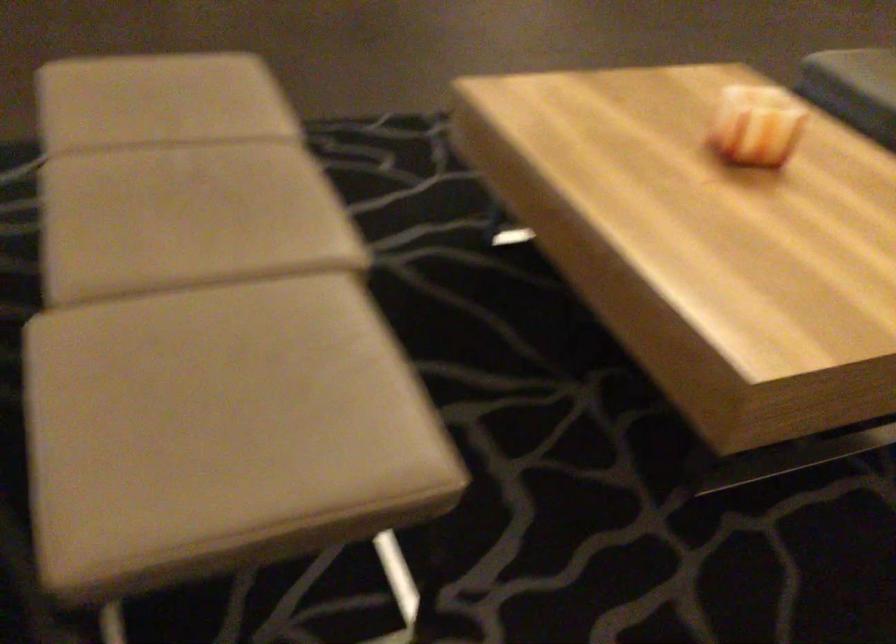
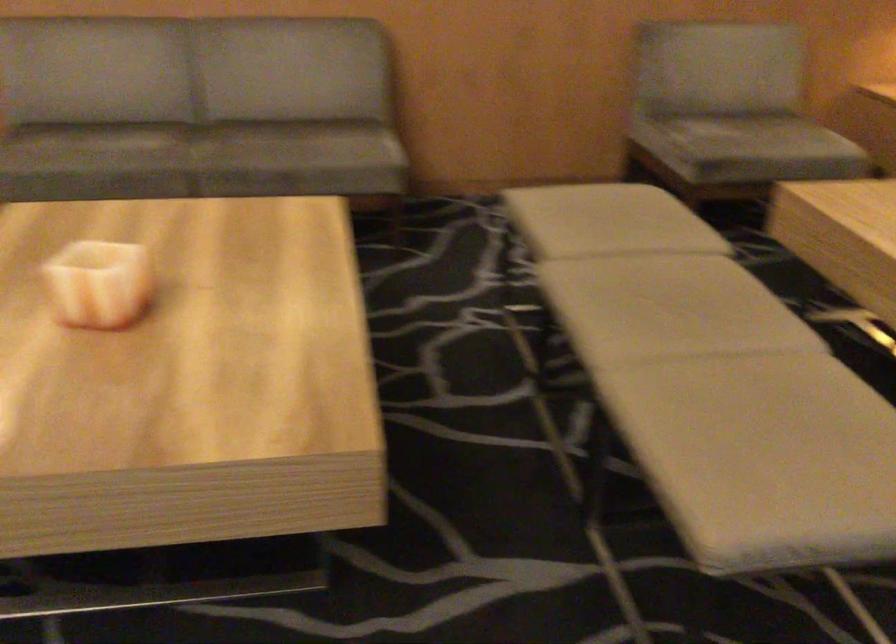
Find the pixel in the second image that matches (213,105) in the first image.

(712, 383)